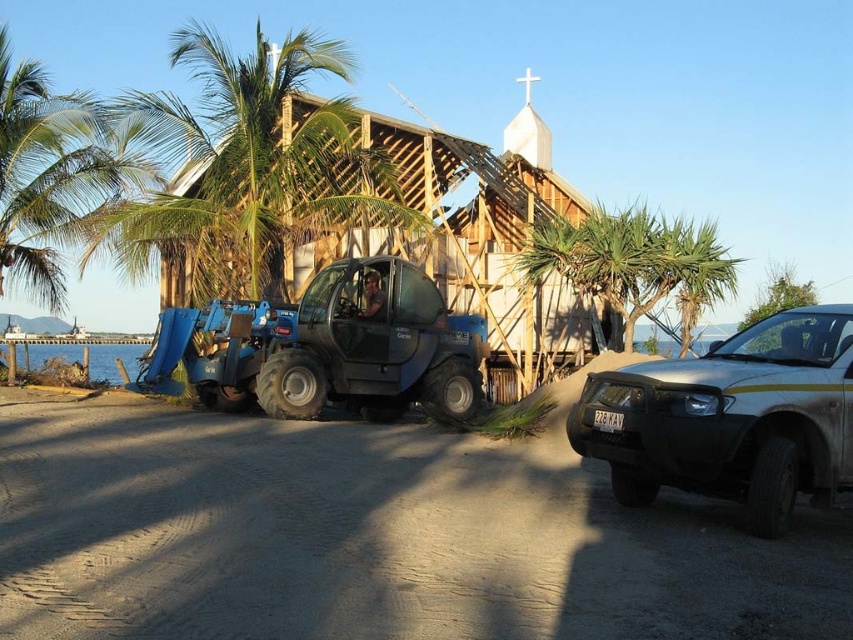
Question: From the image, what is the correct spatial relationship of silver metallic suv at right in relation to blue metallic tractor at center?

Choices:
 (A) left
 (B) right

Answer: (B)

Question: Does green leafy palm tree at center come behind silver metallic suv at right?

Choices:
 (A) yes
 (B) no

Answer: (A)

Question: Which point appears closest to the camera in this image?

Choices:
 (A) (393, 134)
 (B) (331, 348)
 (C) (248, 154)

Answer: (B)

Question: Is green leafy palm tree at center to the right of wooden frame hut at center from the viewer's perspective?

Choices:
 (A) yes
 (B) no

Answer: (B)

Question: Among these points, which one is farthest from the camera?

Choices:
 (A) (242, 314)
 (B) (271, 72)
 (C) (759, 483)

Answer: (B)

Question: Considering the real-world distances, which object is farthest from the silver metallic suv at right?

Choices:
 (A) green leafy palm tree at upper left
 (B) blue metallic tractor at center

Answer: (A)